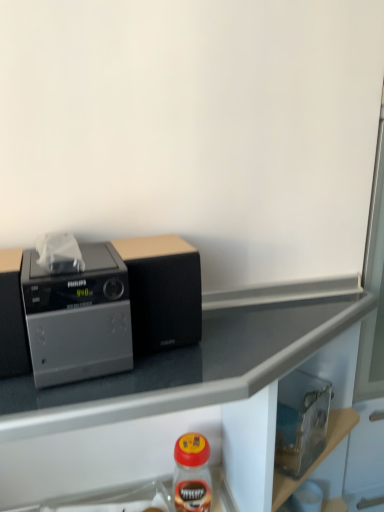
In order to click on matte plastic bottle at lower center in this screenshot , I will do `click(192, 474)`.

Identify the location of satin silver radio at left. (78, 317).

In order to click on matte plastic bottle at lower center in this screenshot , I will do `click(192, 474)`.

From the image's perspective, which is above, satin silver radio at left or black matte speaker at center?

black matte speaker at center appears higher in the image.

Find the location of a particular element. appliance above the satin silver radio at left (from the image's perspective) is located at coordinates coord(162,292).

Does satin silver radio at left have a lesser width compared to black matte speaker at center?

No.

Where is `appliance in front of the matte plastic bottle at lower center`? appliance in front of the matte plastic bottle at lower center is located at coordinates (162, 292).

From a real-world perspective, is black matte speaker at center located beneath matte plastic bottle at lower center?

No, from a real-world perspective, black matte speaker at center is not below matte plastic bottle at lower center.

Which point is more forward, (159, 266) or (189, 443)?

Point (159, 266)

Considering the relative positions of black matte speaker at center and matte plastic bottle at lower center in the image provided, is black matte speaker at center to the left or to the right of matte plastic bottle at lower center?

Based on their positions, black matte speaker at center is located to the left of matte plastic bottle at lower center.

Consider the image. Which of these two, matte plastic bottle at lower center or black matte speaker at center, is thinner?

With smaller width is matte plastic bottle at lower center.

Would you say matte plastic bottle at lower center is a long distance from black matte speaker at center?

No, matte plastic bottle at lower center is not far away from black matte speaker at center.

Choose the correct answer: Is matte plastic bottle at lower center inside black matte speaker at center or outside it?

matte plastic bottle at lower center is outside black matte speaker at center.

Based on their positions, is black matte speaker at center located to the left or right of satin silver radio at left?

black matte speaker at center is to the right of satin silver radio at left.

How much distance is there between black matte speaker at center and satin silver radio at left?

They are 8.89 centimeters apart.

From a real-world perspective, which is physically above, black matte speaker at center or satin silver radio at left?

black matte speaker at center.

Does point (193, 292) come behind point (77, 307)?

That is True.

Which is farther from the camera, [208,448] or [85,253]?

Positioned behind is point [208,448].

Considering the sizes of matte plastic bottle at lower center and satin silver radio at left in the image, is matte plastic bottle at lower center bigger or smaller than satin silver radio at left?

Clearly, matte plastic bottle at lower center is smaller in size than satin silver radio at left.

Can you confirm if matte plastic bottle at lower center is positioned to the left of satin silver radio at left?

Incorrect, matte plastic bottle at lower center is not on the left side of satin silver radio at left.

What's the angular difference between matte plastic bottle at lower center and satin silver radio at left's facing directions?

17 degrees separate the facing orientations of matte plastic bottle at lower center and satin silver radio at left.

Are metallic gray countertop at upper left and black matte speaker at center located far from each other?

They are positioned close to each other.

Who is more distant, metallic gray countertop at upper left or black matte speaker at center?

black matte speaker at center.

From the image's perspective, relative to black matte speaker at center, is metallic gray countertop at upper left above or below?

metallic gray countertop at upper left is below black matte speaker at center.

Which object is positioned more to the left, metallic gray countertop at upper left or black matte speaker at center?

black matte speaker at center is more to the left.

Could matte plastic bottle at lower center be considered to be inside metallic gray countertop at upper left?

Yes, matte plastic bottle at lower center is a part of metallic gray countertop at upper left.

Does metallic gray countertop at upper left turn towards matte plastic bottle at lower center?

Yes, metallic gray countertop at upper left is oriented towards matte plastic bottle at lower center.

What's the angular difference between metallic gray countertop at upper left and matte plastic bottle at lower center's facing directions?

metallic gray countertop at upper left and matte plastic bottle at lower center are facing 12.2 degrees away from each other.

From a real-world perspective, is metallic gray countertop at upper left on top of matte plastic bottle at lower center?

Yes.

Identify the location of home appliance below the black matte speaker at center (from the image's perspective). (78, 317).

This screenshot has height=512, width=384. I want to click on appliance above the matte plastic bottle at lower center (from the image's perspective), so click(x=162, y=292).

Looking at the image, which one is located further to metallic gray countertop at upper left, satin silver radio at left or black matte speaker at center?

satin silver radio at left.

Estimate the real-world distances between objects in this image. Which object is closer to satin silver radio at left, matte plastic bottle at lower center or black matte speaker at center?

black matte speaker at center is positioned closer to the anchor satin silver radio at left.

When comparing their distances from satin silver radio at left, does metallic gray countertop at upper left or matte plastic bottle at lower center seem closer?

Among the two, metallic gray countertop at upper left is located nearer to satin silver radio at left.

Considering their positions, is black matte speaker at center positioned closer to matte plastic bottle at lower center than metallic gray countertop at upper left?

Based on the image, metallic gray countertop at upper left appears to be nearer to matte plastic bottle at lower center.

Based on their spatial positions, is metallic gray countertop at upper left or matte plastic bottle at lower center further from black matte speaker at center?

Among the two, matte plastic bottle at lower center is located further to black matte speaker at center.

Based on the photo, from the image, which object appears to be farther from metallic gray countertop at upper left, black matte speaker at center or matte plastic bottle at lower center?

black matte speaker at center is positioned further to the anchor metallic gray countertop at upper left.

Looking at the image, which one is located further to satin silver radio at left, matte plastic bottle at lower center or metallic gray countertop at upper left?

matte plastic bottle at lower center is further to satin silver radio at left.

Estimate the real-world distances between objects in this image. Which object is closer to metallic gray countertop at upper left, matte plastic bottle at lower center or black matte speaker at center?

matte plastic bottle at lower center is positioned closer to the anchor metallic gray countertop at upper left.

At what (x,y) coordinates should I click in order to perform the action: click on countertop between black matte speaker at center and matte plastic bottle at lower center in the vertical direction. Please return your answer as a coordinate pair (x, y). Looking at the image, I should click on (167, 405).

You are a GUI agent. You are given a task and a screenshot of the screen. Output one action in this format:
    pyautogui.click(x=<x>, y=<y>)
    Task: Click on the home appliance between black matte speaker at center and matte plastic bottle at lower center from top to bottom
    
    Given the screenshot: What is the action you would take?
    coord(78,317)

I want to click on countertop between satin silver radio at left and matte plastic bottle at lower center vertically, so click(167, 405).

Find the location of a particular element. home appliance between black matte speaker at center and metallic gray countertop at upper left in the vertical direction is located at coordinates (78, 317).